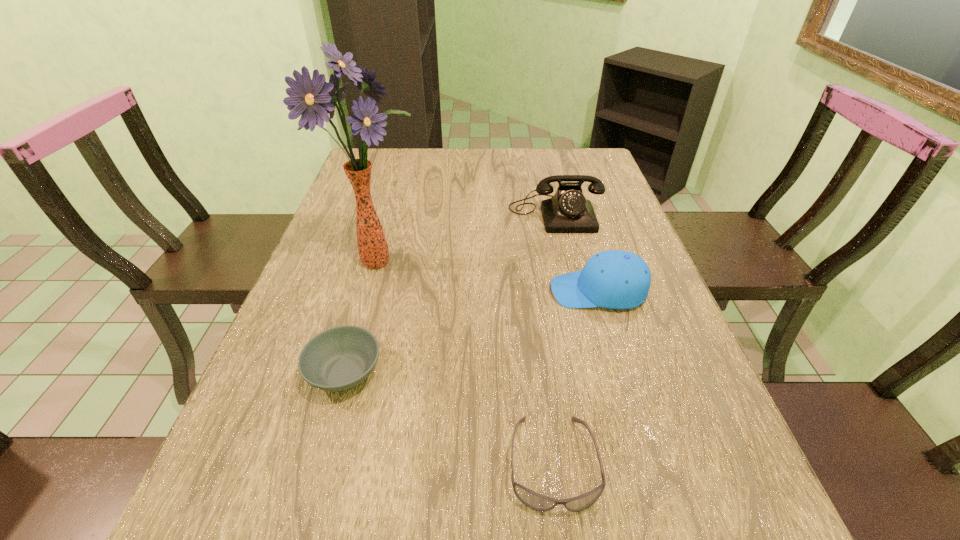
Locate an element on the screen. This screenshot has width=960, height=540. free space located on the back of the soup bowl is located at coordinates (361, 315).

At what (x,y) coordinates should I click in order to perform the action: click on flower arrangement at the left edge. Please return your answer as a coordinate pair (x, y). Looking at the image, I should click on (314, 99).

Where is `soup bowl located in the left edge section of the desktop`? This screenshot has width=960, height=540. soup bowl located in the left edge section of the desktop is located at coordinates pyautogui.click(x=339, y=358).

Where is `telephone that is at the right edge`? telephone that is at the right edge is located at coordinates [x=568, y=211].

You are a GUI agent. You are given a task and a screenshot of the screen. Output one action in this format:
    pyautogui.click(x=<x>, y=<y>)
    Task: Click on the cap that is positioned at the right edge
    
    Given the screenshot: What is the action you would take?
    pyautogui.click(x=613, y=279)

At what (x,y) coordinates should I click in order to perform the action: click on vacant space at the far edge. Please return your answer as a coordinate pair (x, y). Looking at the image, I should click on (553, 166).

The height and width of the screenshot is (540, 960). In order to click on vacant space at the left edge of the desktop in this screenshot , I will do `click(321, 249)`.

The image size is (960, 540). In the image, there is a desktop. Identify the location of free space at the right edge. (614, 354).

Find the location of `vacant space at the far left corner of the desktop`. vacant space at the far left corner of the desktop is located at coordinates (399, 151).

In the image, there is a desktop. At what (x,y) coordinates should I click in order to perform the action: click on blank space at the far right corner. Please return your answer as a coordinate pair (x, y). Looking at the image, I should click on (573, 161).